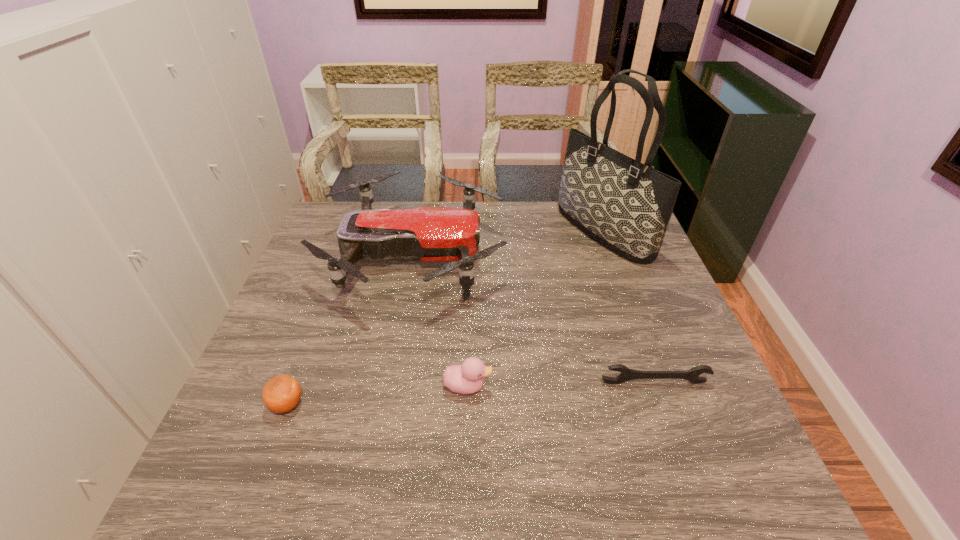
The height and width of the screenshot is (540, 960). I want to click on tote bag, so click(x=625, y=205).

Image resolution: width=960 pixels, height=540 pixels. What are the coordinates of `the second tallest object` in the screenshot? It's located at (428, 234).

The height and width of the screenshot is (540, 960). Find the location of `duckling`. duckling is located at coordinates (467, 378).

Image resolution: width=960 pixels, height=540 pixels. What are the coordinates of `orange` in the screenshot? It's located at (282, 393).

Identify the location of wrench. (692, 375).

I want to click on free space located on the front of the tote bag, so click(627, 298).

Identify the location of free space located on the front-facing side of the drone. (623, 256).

Find the location of a particular element. free space located 0.220m on the front-facing side of the duckling is located at coordinates (591, 386).

Identify the location of free spot located 0.070m on the front of the orange. (269, 453).

What are the coordinates of `vacant point located on the open ends of the wrench` in the screenshot? It's located at click(661, 404).